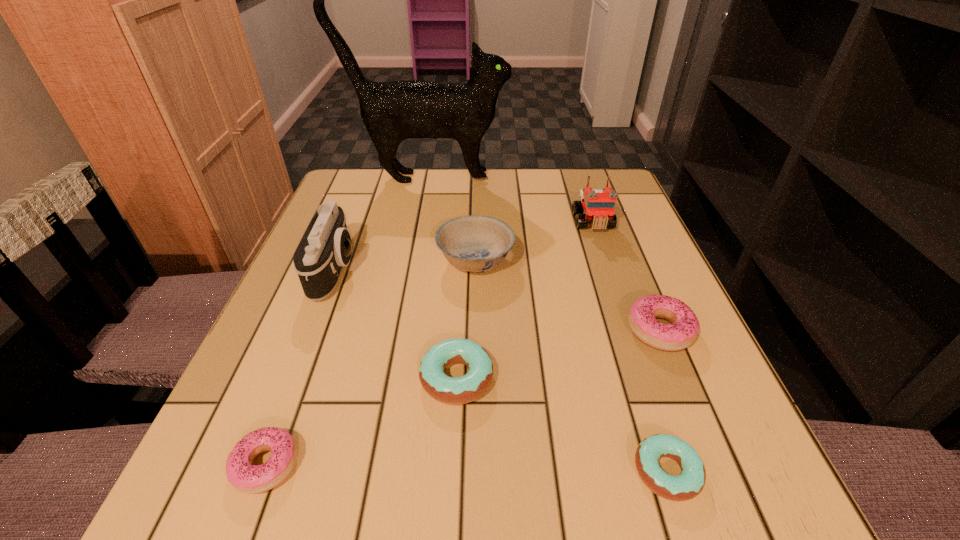
The height and width of the screenshot is (540, 960). Find the location of `vacant area situated 0.090m on the right of the second doughnut from left to right`. vacant area situated 0.090m on the right of the second doughnut from left to right is located at coordinates (548, 378).

Find the location of a particular element. The height and width of the screenshot is (540, 960). vacant area located 0.240m on the back of the nearer pink doughnut is located at coordinates (322, 316).

In order to click on vacant space located 0.210m on the left of the shortest doughnut in this screenshot , I will do `click(480, 471)`.

Where is `cat located in the far edge section of the desktop`? Image resolution: width=960 pixels, height=540 pixels. cat located in the far edge section of the desktop is located at coordinates (393, 111).

This screenshot has width=960, height=540. Identify the location of Lego that is positioned at the far edge. (599, 205).

Where is `cat that is positioned at the left edge`? cat that is positioned at the left edge is located at coordinates (393, 111).

This screenshot has height=540, width=960. Identify the location of camera situated at the left edge. (325, 247).

The height and width of the screenshot is (540, 960). I want to click on doughnut that is at the left edge, so click(252, 479).

What are the coordinates of `Lego that is at the right edge` in the screenshot? It's located at (599, 205).

This screenshot has width=960, height=540. Find the location of `object that is at the far left corner`. object that is at the far left corner is located at coordinates (393, 111).